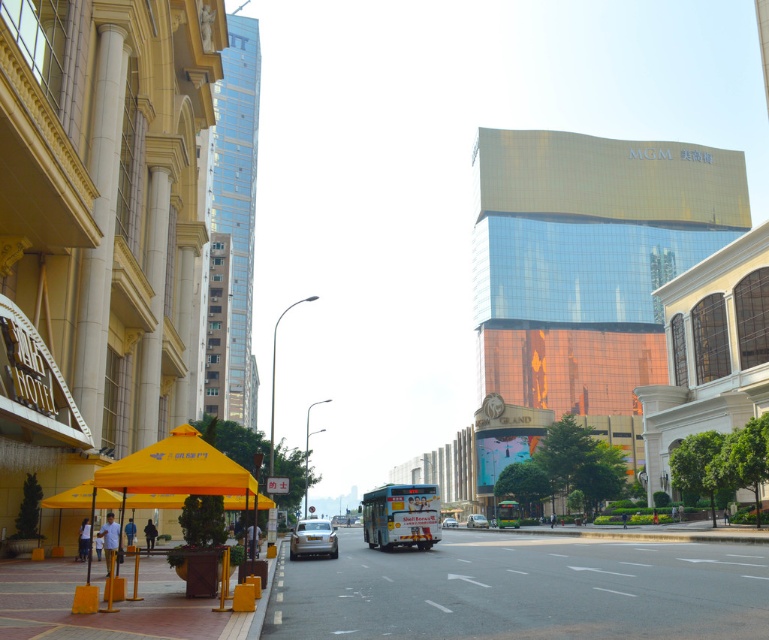
Can you confirm if green metallic bus at center is shorter than shiny silver car at center?

Yes, green metallic bus at center is shorter than shiny silver car at center.

Based on the photo, does green metallic bus at center have a greater height compared to shiny silver car at center?

No.

I want to click on green metallic bus at center, so click(x=508, y=513).

Who is positioned more to the right, gold metallic car at center or shiny silver car at center?

shiny silver car at center

Who is more forward, [298,532] or [451,518]?

Point [298,532] is in front.

Image resolution: width=769 pixels, height=640 pixels. In order to click on gold metallic car at center in this screenshot , I will do `click(311, 538)`.

Looking at this image, is yellow fabric canopy at lower left closer to the viewer compared to green metallic bus at center?

Yes.

Is yellow fabric canopy at lower left above green metallic bus at center?

Indeed, yellow fabric canopy at lower left is positioned over green metallic bus at center.

Who is more forward, (185, 452) or (514, 518)?

Point (185, 452) is in front.

Identify the location of yellow fabric canopy at lower left. This screenshot has height=640, width=769. click(177, 468).